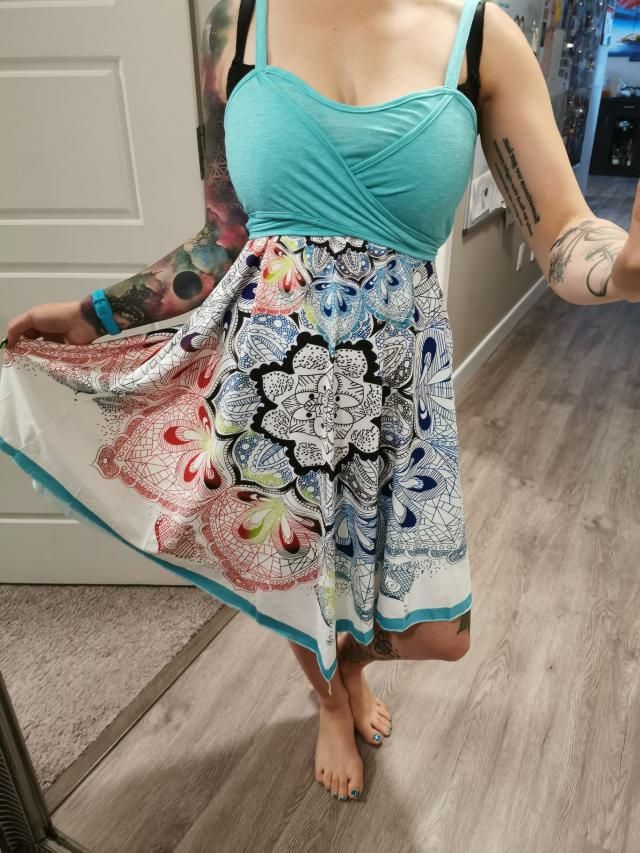
I want to click on wood floor, so click(x=459, y=768).